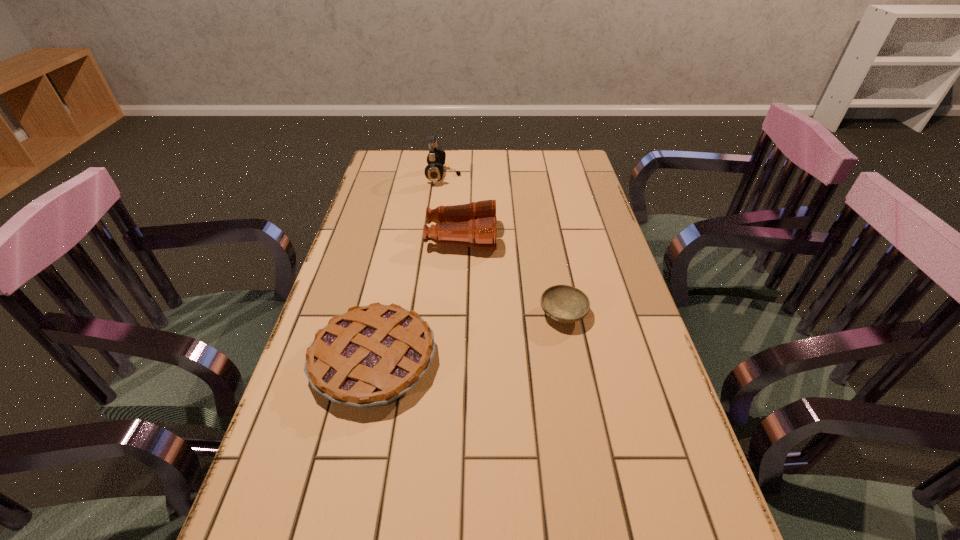
The height and width of the screenshot is (540, 960). Find the location of `free space between the shortest object and the pie`. free space between the shortest object and the pie is located at coordinates (468, 338).

Find the location of a particular element. free space between the second tallest object and the shortest object is located at coordinates (513, 276).

Find the location of a particular element. Image resolution: width=960 pixels, height=540 pixels. blank region between the pie and the headset is located at coordinates (409, 269).

The image size is (960, 540). I want to click on free space between the bowl and the farthest object, so click(503, 246).

This screenshot has width=960, height=540. I want to click on vacant area that lies between the pie and the binoculars, so click(x=418, y=300).

At what (x,y) coordinates should I click in order to perform the action: click on object that ranks as the third closest to the third tallest object. Please return your answer as a coordinate pair (x, y). Image resolution: width=960 pixels, height=540 pixels. Looking at the image, I should click on (434, 171).

You are a GUI agent. You are given a task and a screenshot of the screen. Output one action in this format:
    pyautogui.click(x=<x>, y=<y>)
    Task: Click on the object identified as the third closest to the second farthest object
    
    Given the screenshot: What is the action you would take?
    [x=370, y=356]

This screenshot has height=540, width=960. I want to click on vacant point that satisfies the following two spatial constraints: 1. through the lenses of the rightmost object; 2. on the right side of the binoculars, so click(457, 314).

Locate an element on the screen. This screenshot has width=960, height=540. vacant space that satisfies the following two spatial constraints: 1. on the back side of the bowl; 2. through the lenses of the binoculars is located at coordinates (548, 238).

This screenshot has width=960, height=540. What are the coordinates of `free space in the image that satisfies the following two spatial constraints: 1. through the lenses of the second farthest object; 2. on the back side of the shortest object` in the screenshot? It's located at (457, 314).